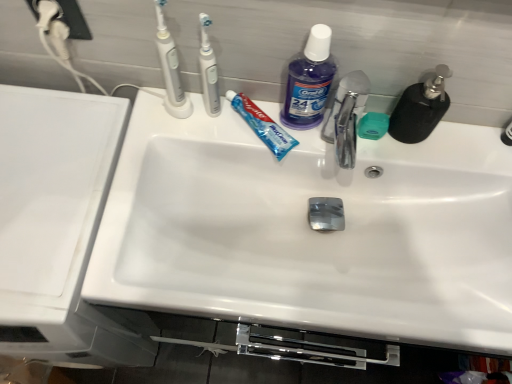
Question: Which direction should I rotate to face white plastic toothbrush at upper center, which ranks as the 1th toothbrush in right-to-left order, — up or down?

Choices:
 (A) down
 (B) up

Answer: (B)

Question: From the image's perspective, is white plastic toothbrush at upper left, placed as the 1th toothbrush when sorted from left to right, above white glossy sink at center?

Choices:
 (A) no
 (B) yes

Answer: (B)

Question: From a real-world perspective, does white plastic toothbrush at upper left, which appears as the 2th toothbrush when viewed from the right, sit lower than white glossy sink at center?

Choices:
 (A) yes
 (B) no

Answer: (B)

Question: From the image's perspective, would you say white plastic toothbrush at upper left, placed as the 1th toothbrush when sorted from left to right, is shown under white glossy sink at center?

Choices:
 (A) no
 (B) yes

Answer: (A)

Question: Considering the relative positions of white plastic toothbrush at upper left, placed as the 1th toothbrush when sorted from left to right, and white glossy sink at center in the image provided, is white plastic toothbrush at upper left, placed as the 1th toothbrush when sorted from left to right, to the left of white glossy sink at center from the viewer's perspective?

Choices:
 (A) yes
 (B) no

Answer: (A)

Question: Is white plastic toothbrush at upper left, placed as the 1th toothbrush when sorted from left to right, aimed at white glossy sink at center?

Choices:
 (A) no
 (B) yes

Answer: (A)

Question: Would you say white plastic toothbrush at upper left, placed as the 1th toothbrush when sorted from left to right, is outside white glossy sink at center?

Choices:
 (A) yes
 (B) no

Answer: (A)

Question: Does green matte soap at center appear on the right side of white glossy sink at center?

Choices:
 (A) no
 (B) yes

Answer: (B)

Question: Is green matte soap at center to the left of white glossy sink at center from the viewer's perspective?

Choices:
 (A) no
 (B) yes

Answer: (A)

Question: Can you confirm if green matte soap at center is thinner than white glossy sink at center?

Choices:
 (A) no
 (B) yes

Answer: (B)

Question: Is white glossy sink at center a part of green matte soap at center?

Choices:
 (A) no
 (B) yes

Answer: (A)

Question: From the image's perspective, is green matte soap at center beneath white glossy sink at center?

Choices:
 (A) no
 (B) yes

Answer: (A)

Question: Is green matte soap at center wider than white glossy sink at center?

Choices:
 (A) yes
 (B) no

Answer: (B)

Question: Does white glossy sink at left have a larger size compared to white glossy sink at center?

Choices:
 (A) no
 (B) yes

Answer: (B)